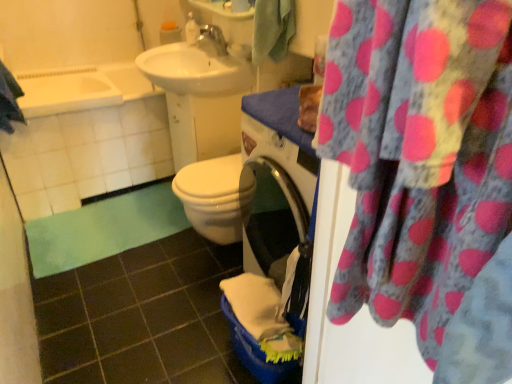
Question: Is pink polka dot fabric at upper right to the left of blue textured towel at upper left, the 1th beach towel viewed from the left, from the viewer's perspective?

Choices:
 (A) no
 (B) yes

Answer: (A)

Question: Considering the relative sizes of pink polka dot fabric at upper right and blue textured towel at upper left, positioned as the second beach towel in right-to-left order, in the image provided, is pink polka dot fabric at upper right thinner than blue textured towel at upper left, positioned as the second beach towel in right-to-left order,?

Choices:
 (A) yes
 (B) no

Answer: (A)

Question: Considering the relative positions of pink polka dot fabric at upper right and blue textured towel at upper left, positioned as the second beach towel in right-to-left order, in the image provided, is pink polka dot fabric at upper right behind blue textured towel at upper left, positioned as the second beach towel in right-to-left order,?

Choices:
 (A) no
 (B) yes

Answer: (A)

Question: Is pink polka dot fabric at upper right shorter than blue textured towel at upper left, positioned as the second beach towel in right-to-left order?

Choices:
 (A) yes
 (B) no

Answer: (B)

Question: Is pink polka dot fabric at upper right to the right of blue textured towel at upper left, the 1th beach towel viewed from the left, from the viewer's perspective?

Choices:
 (A) no
 (B) yes

Answer: (B)

Question: Is pink polka dot fabric at upper right aimed at blue textured towel at upper left, positioned as the second beach towel in right-to-left order?

Choices:
 (A) no
 (B) yes

Answer: (A)

Question: Does green fabric towel at upper center, which ranks as the 2th beach towel in left-to-right order, have a lesser width compared to pink polka dot fabric at upper right?

Choices:
 (A) no
 (B) yes

Answer: (A)

Question: Is the surface of green fabric towel at upper center, marked as the 1th beach towel in a right-to-left arrangement, in direct contact with pink polka dot fabric at upper right?

Choices:
 (A) no
 (B) yes

Answer: (A)

Question: From a real-world perspective, is green fabric towel at upper center, marked as the 1th beach towel in a right-to-left arrangement, over pink polka dot fabric at upper right?

Choices:
 (A) no
 (B) yes

Answer: (B)

Question: From a real-world perspective, is green fabric towel at upper center, marked as the 1th beach towel in a right-to-left arrangement, positioned under pink polka dot fabric at upper right based on gravity?

Choices:
 (A) no
 (B) yes

Answer: (A)

Question: Is green fabric towel at upper center, which ranks as the 2th beach towel in left-to-right order, outside of pink polka dot fabric at upper right?

Choices:
 (A) yes
 (B) no

Answer: (A)

Question: Can you confirm if green fabric towel at upper center, which ranks as the 2th beach towel in left-to-right order, is taller than pink polka dot fabric at upper right?

Choices:
 (A) yes
 (B) no

Answer: (B)

Question: Is pink polka dot fabric at upper right surrounded by silver metallic faucet at upper center?

Choices:
 (A) yes
 (B) no

Answer: (B)